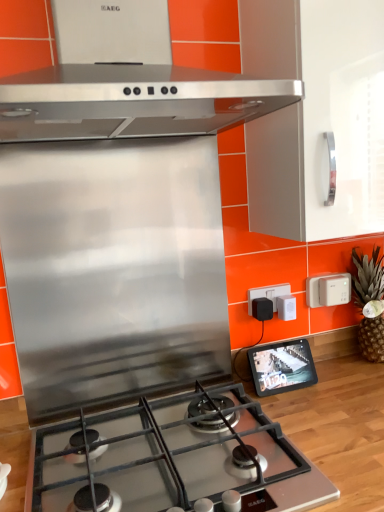
Question: Can you confirm if stainless steel gas stove at center is bigger than green textured pineapple at right?

Choices:
 (A) yes
 (B) no

Answer: (A)

Question: Is stainless steel gas stove at center taller than green textured pineapple at right?

Choices:
 (A) yes
 (B) no

Answer: (B)

Question: From the image's perspective, is stainless steel gas stove at center located above green textured pineapple at right?

Choices:
 (A) no
 (B) yes

Answer: (A)

Question: Is stainless steel gas stove at center not inside green textured pineapple at right?

Choices:
 (A) no
 (B) yes

Answer: (B)

Question: Is stainless steel gas stove at center placed right next to green textured pineapple at right?

Choices:
 (A) yes
 (B) no

Answer: (B)

Question: Is stainless steel gas stove at center wider than green textured pineapple at right?

Choices:
 (A) yes
 (B) no

Answer: (A)

Question: Can you confirm if green textured pineapple at right is smaller than white plastic electric outlet at upper right, the 1th electric outlet positioned from the right?

Choices:
 (A) yes
 (B) no

Answer: (B)

Question: Does green textured pineapple at right appear on the left side of white plastic electric outlet at upper right, the second electric outlet when ordered from left to right?

Choices:
 (A) yes
 (B) no

Answer: (B)

Question: From the image's perspective, is green textured pineapple at right on top of white plastic electric outlet at upper right, the second electric outlet when ordered from left to right?

Choices:
 (A) no
 (B) yes

Answer: (A)

Question: Could you tell me if green textured pineapple at right is facing white plastic electric outlet at upper right, the second electric outlet when ordered from left to right?

Choices:
 (A) no
 (B) yes

Answer: (A)

Question: Can we say green textured pineapple at right lies outside white plastic electric outlet at upper right, the 1th electric outlet positioned from the right?

Choices:
 (A) no
 (B) yes

Answer: (B)

Question: Does green textured pineapple at right have a lesser width compared to white plastic electric outlet at upper right, the second electric outlet when ordered from left to right?

Choices:
 (A) yes
 (B) no

Answer: (B)

Question: Is green textured pineapple at right shorter than black plastic at upper right, the second electric outlet in the right-to-left sequence?

Choices:
 (A) yes
 (B) no

Answer: (B)